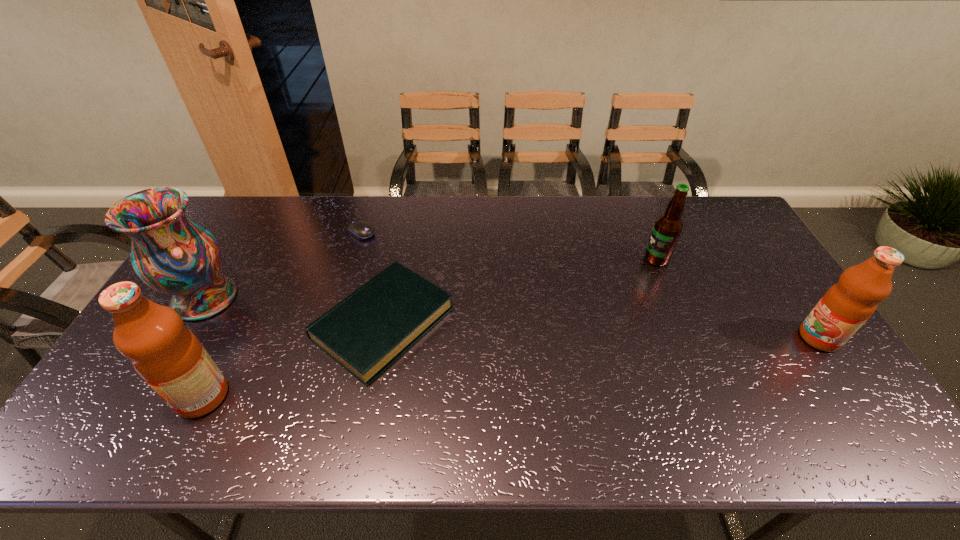
Locate an element on the screen. The height and width of the screenshot is (540, 960). free region located on the left of the book is located at coordinates (219, 323).

Image resolution: width=960 pixels, height=540 pixels. Identify the location of blank area located on the front of the vase. (169, 357).

The height and width of the screenshot is (540, 960). I want to click on object at the far edge, so click(x=361, y=229).

Locate an element on the screen. The width and height of the screenshot is (960, 540). fruit juice located at the near edge is located at coordinates pyautogui.click(x=169, y=357).

Where is `book that is at the near edge`? This screenshot has height=540, width=960. book that is at the near edge is located at coordinates (366, 332).

Where is `object present at the left edge`? This screenshot has width=960, height=540. object present at the left edge is located at coordinates (172, 254).

At what (x,y) coordinates should I click in order to perform the action: click on object at the right edge. Please return your answer as a coordinate pair (x, y). This screenshot has width=960, height=540. Looking at the image, I should click on (847, 305).

Where is `vacant region at the far edge of the desktop`? vacant region at the far edge of the desktop is located at coordinates click(x=612, y=197).

In the image, there is a desktop. Identify the location of vacant region at the near edge. The image size is (960, 540). (629, 407).

The width and height of the screenshot is (960, 540). I want to click on vacant space at the left edge, so click(x=191, y=327).